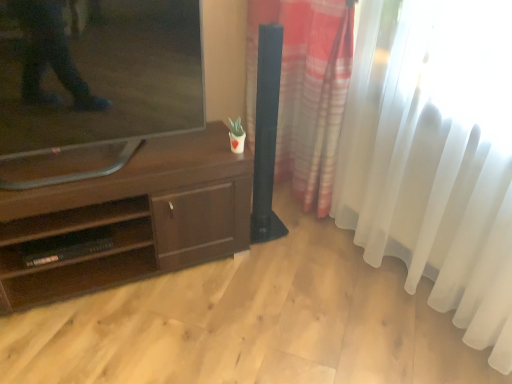
You are a GUI agent. You are given a task and a screenshot of the screen. Output one action in this format:
    pyautogui.click(x=<x>, y=<y>)
    Task: Click on the free spot above dark brown wood tv stand at center (from a real-world perspective)
    The image size is (512, 384).
    Given the screenshot: What is the action you would take?
    pyautogui.click(x=110, y=163)